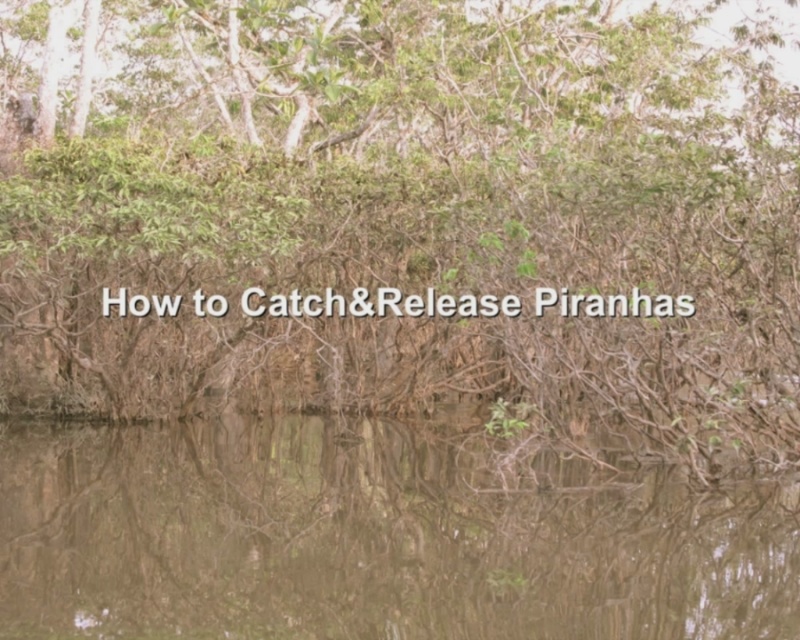
This screenshot has height=640, width=800. Describe the element at coordinates (408, 218) in the screenshot. I see `green leafy tree at center` at that location.

Is green leafy tree at center taller than brown murky water at center?

Indeed, green leafy tree at center has a greater height compared to brown murky water at center.

What are the coordinates of `green leafy tree at center` in the screenshot? It's located at (408, 218).